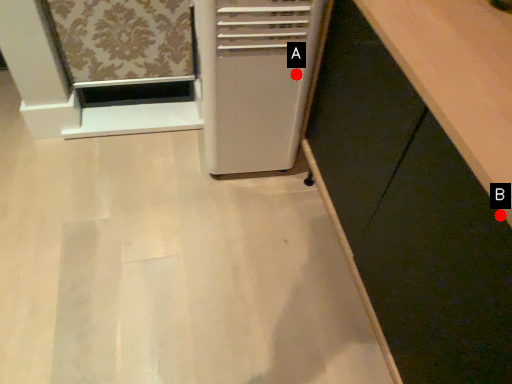
Question: Two points are circled on the image, labeled by A and B beside each circle. Which point appears farthest from the camera in this image?

Choices:
 (A) A is further
 (B) B is further

Answer: (A)